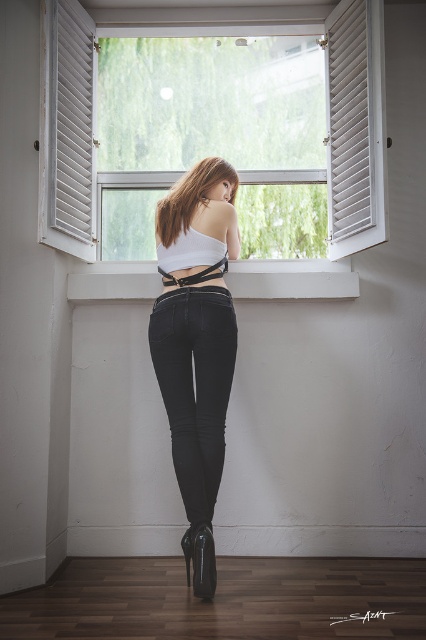
Question: Which point is closer to the camera?

Choices:
 (A) (261, 292)
 (B) (183, 545)
 (C) (213, 257)
 (D) (94, 166)

Answer: (B)

Question: Is matte black jeans at center to the right of black patent leather boot at lower center from the viewer's perspective?

Choices:
 (A) yes
 (B) no

Answer: (B)

Question: Among these objects, which one is nearest to the camera?

Choices:
 (A) black patent leather boot at lower center
 (B) matte black jeans at center
 (C) white wooden window at center
 (D) white smooth window sill at center

Answer: (A)

Question: Can you confirm if white wooden window at center is positioned to the right of white smooth window sill at center?

Choices:
 (A) no
 (B) yes

Answer: (A)

Question: Which of the following is the closest to the observer?

Choices:
 (A) white wooden window at center
 (B) black patent leather boot at lower center

Answer: (B)

Question: Can you confirm if matte black jeans at center is thinner than white smooth window sill at center?

Choices:
 (A) no
 (B) yes

Answer: (B)